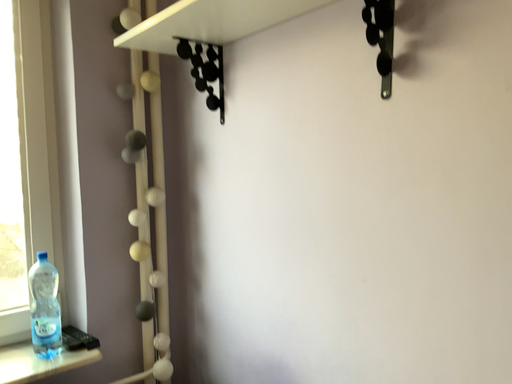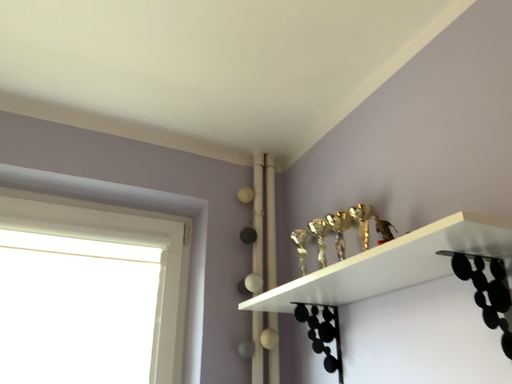
Question: How did the camera likely rotate when shooting the video?

Choices:
 (A) rotated left
 (B) rotated right

Answer: (A)